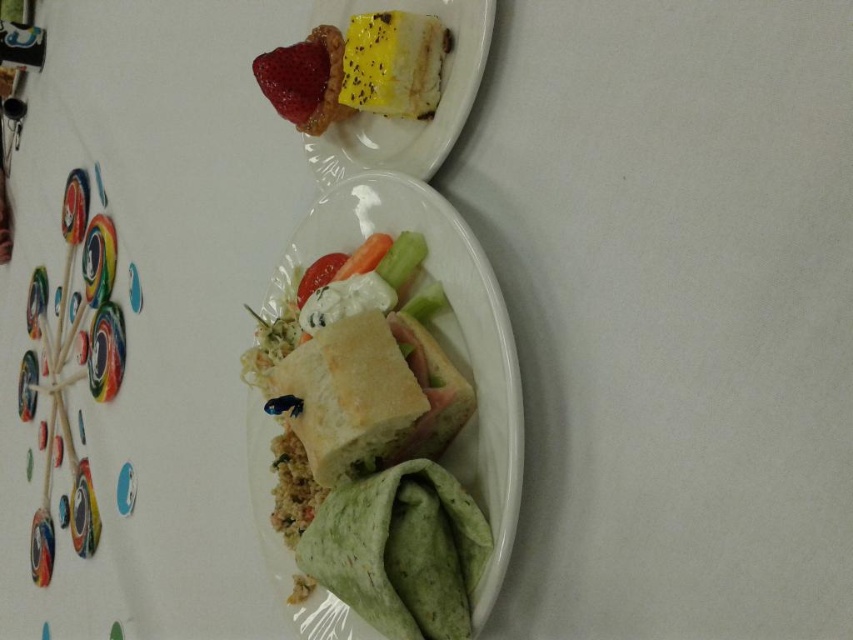
What do you see at coordinates (294, 80) in the screenshot? I see `red matte strawberry at upper left` at bounding box center [294, 80].

What do you see at coordinates (294, 80) in the screenshot? I see `red matte strawberry at upper left` at bounding box center [294, 80].

The image size is (853, 640). I want to click on red matte strawberry at upper left, so click(x=294, y=80).

Who is more forward, (492, 556) or (283, 60)?

Positioned in front is point (492, 556).

Is point (370, 202) more distant than point (293, 100)?

No, (370, 202) is closer to viewer.

I want to click on white bread at center, so click(442, 330).

Between green tortilla at lower left and smooth white strawberry at center, which one has less height?

Standing shorter between the two is smooth white strawberry at center.

Which is behind, point (410, 490) or point (312, 266)?

Positioned behind is point (312, 266).

Locate an element on the screen. green tortilla at lower left is located at coordinates (399, 550).